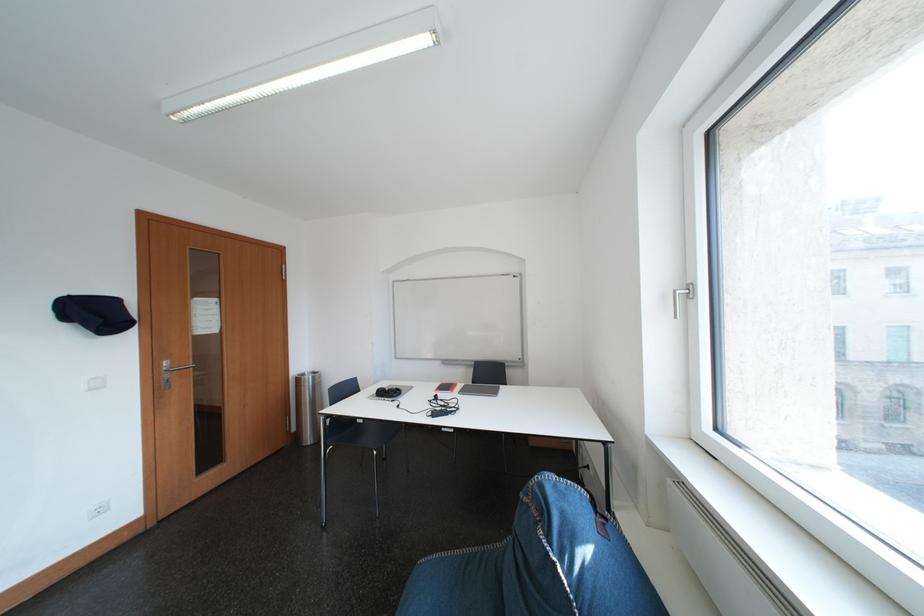
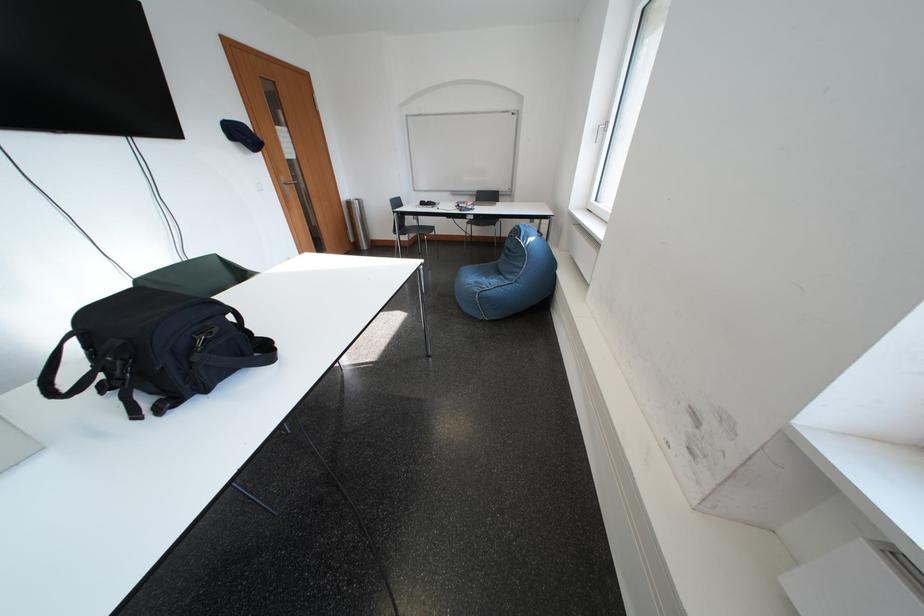
The point at (310, 383) is marked in the first image. Where is the corresponding point in the second image?

(360, 207)